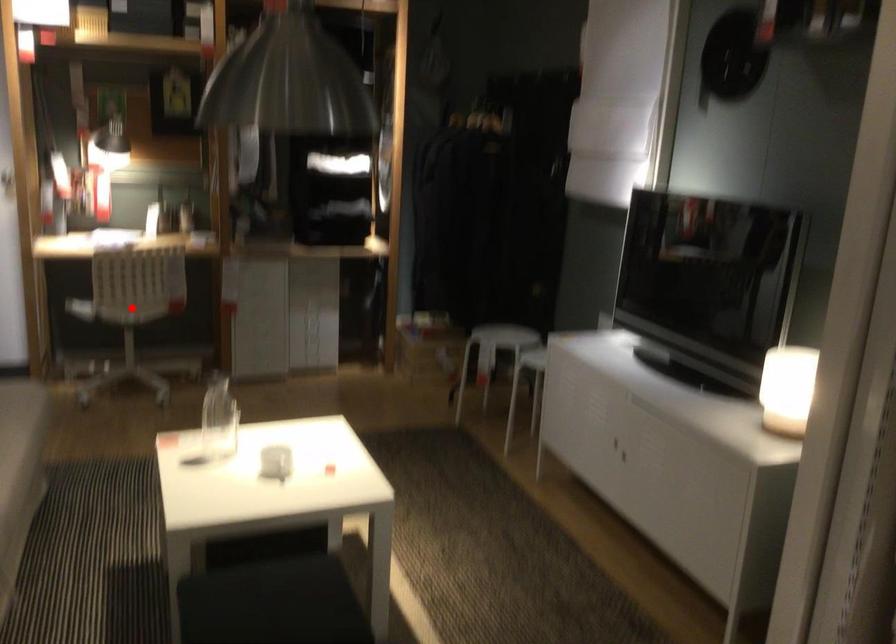
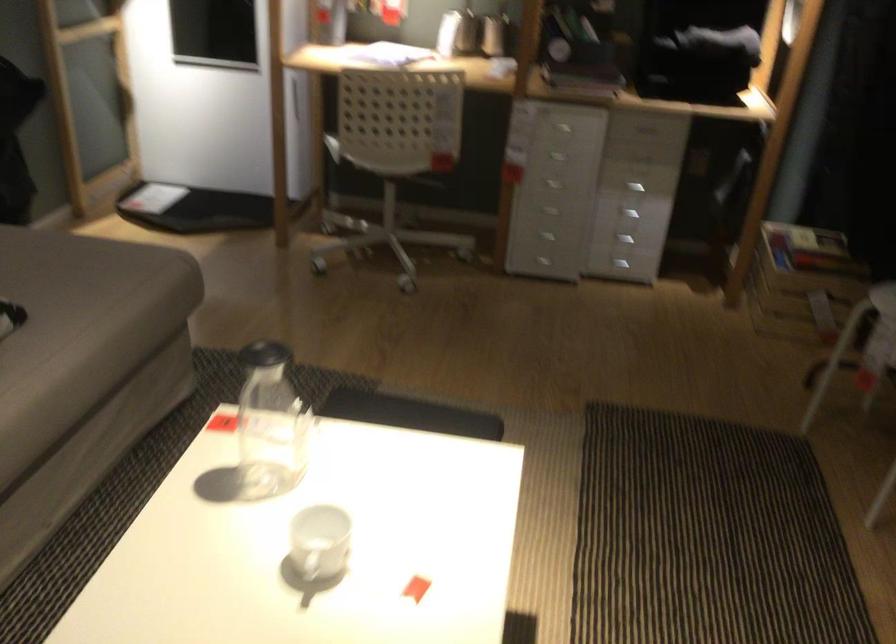
Where in the second image is the point corresponding to the highlighted location from the first image?

(388, 158)